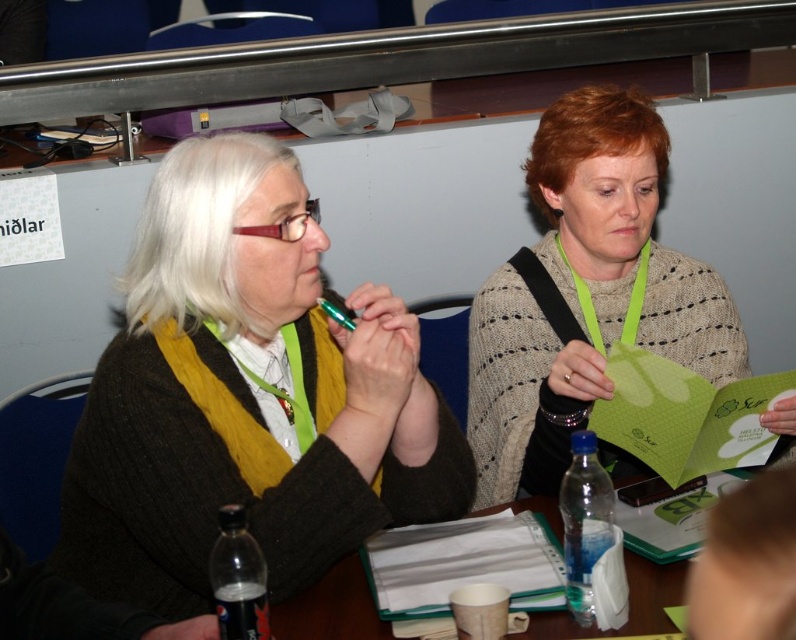
Is matte black sweater at center shorter than knitted beige sweater at center?

Yes.

Which is behind, point (369, 440) or point (539, 403)?

Point (539, 403)

Who is more forward, (235, 291) or (662, 180)?

Point (235, 291)

Where is `matte black sweater at center`? The height and width of the screenshot is (640, 796). matte black sweater at center is located at coordinates (246, 396).